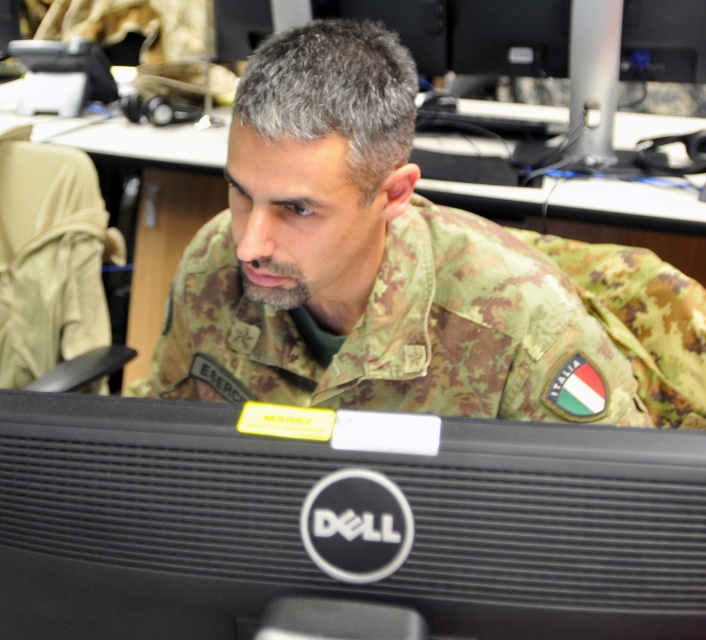
Between black plastic monitor at center and camouflage fabric uniform at center, which one appears on the left side from the viewer's perspective?

black plastic monitor at center is more to the left.

Which is below, black plastic monitor at center or camouflage fabric uniform at center?

black plastic monitor at center

The width and height of the screenshot is (706, 640). In order to click on black plastic monitor at center in this screenshot , I will do `click(299, 532)`.

Find the location of a particular element. This screenshot has width=706, height=640. black plastic monitor at center is located at coordinates (299, 532).